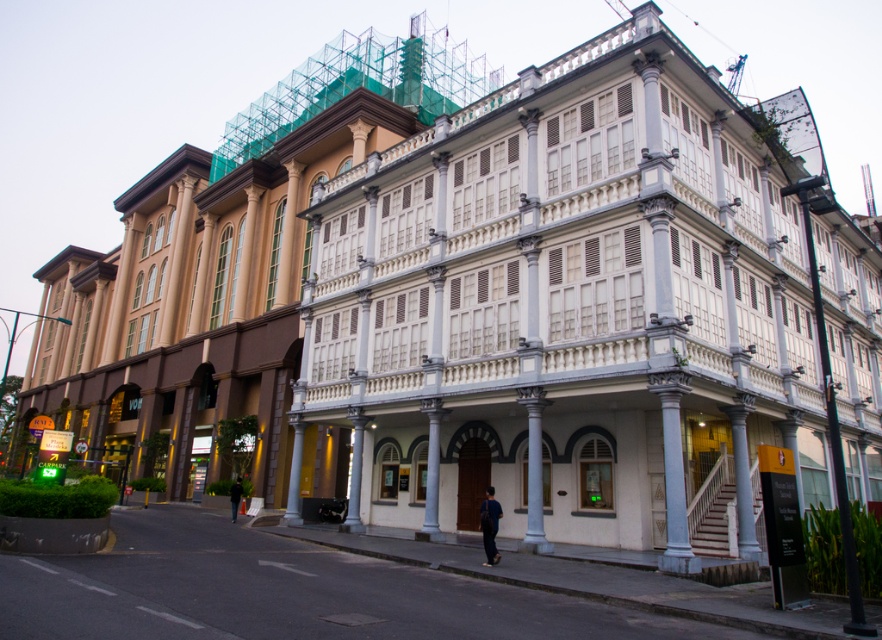
Which is below, white stone column at center or black fabric jacket at lower center?

Positioned lower is black fabric jacket at lower center.

Between white stone column at center and black fabric jacket at lower center, which one appears on the left side from the viewer's perspective?

black fabric jacket at lower center

This screenshot has width=882, height=640. What are the coordinates of `white stone column at center` in the screenshot? It's located at click(x=431, y=472).

The image size is (882, 640). Find the location of `white stone column at center`. white stone column at center is located at coordinates (431, 472).

In the scene shown: Does gray stone column at center appear over white stone column at center?

Yes, gray stone column at center is above white stone column at center.

Is point (531, 388) less distant than point (424, 513)?

Yes, it is in front of point (424, 513).

The height and width of the screenshot is (640, 882). In order to click on gray stone column at center in this screenshot , I will do `click(533, 474)`.

Does white marble building at center have a smaller size compared to gray stone column at center?

No, white marble building at center is not smaller than gray stone column at center.

Can you confirm if white marble building at center is positioned to the left of gray stone column at center?

No, white marble building at center is not to the left of gray stone column at center.

Is point (574, 474) farther from camera compared to point (537, 524)?

Yes, point (574, 474) is behind point (537, 524).

At what (x,y) coordinates should I click in order to perform the action: click on white marble building at center. Please return your answer as a coordinate pair (x, y). This screenshot has width=882, height=640. Looking at the image, I should click on (594, 305).